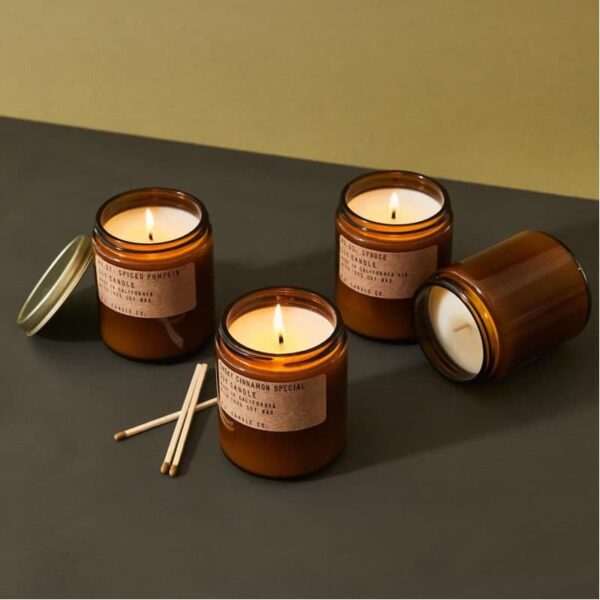
This screenshot has width=600, height=600. What are the coordinates of `green wall` in the screenshot? It's located at (387, 79).